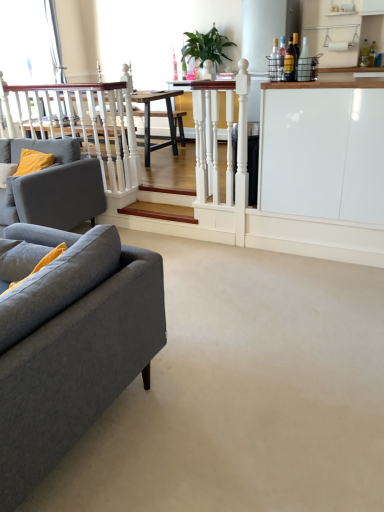
Describe the element at coordinates (323, 148) in the screenshot. The width and height of the screenshot is (384, 512). I see `white glossy cabinet at right` at that location.

How much space does matte gray fabric couch at left, which appears as the 2th studio couch when viewed from the front, occupy vertically?

34.49 inches.

At what (x,y) coordinates should I click in order to perform the action: click on green leafy plant at upper center. Please return your answer as a coordinate pair (x, y). Looking at the image, I should click on coord(206,47).

I want to click on gray fabric couch at left, which is counted as the 1th studio couch, starting from the front, so click(69, 342).

Measure the distance between gray fabric couch at left, the 2th studio couch from the back, and camera.

gray fabric couch at left, the 2th studio couch from the back, and camera are 1.21 meters apart from each other.

You are a GUI agent. You are given a task and a screenshot of the screen. Output one action in this format:
    pyautogui.click(x=<x>, y=<y>)
    Task: Click on the white glossy cabinet at right
    The width and height of the screenshot is (384, 512).
    Given the screenshot: What is the action you would take?
    [x=323, y=148]

What's the angular difference between wooden stairs at center and white glossy cabinet at right's facing directions?

They differ by 180 degrees in their facing directions.

Based on their sizes in the image, would you say wooden stairs at center is bigger or smaller than white glossy cabinet at right?

In the image, wooden stairs at center appears to be smaller than white glossy cabinet at right.

Consider the image. From a real-world perspective, who is located lower, wooden stairs at center or white glossy cabinet at right?

wooden stairs at center.

I want to click on stairwell located behind the gray fabric couch at left, which is counted as the 1th studio couch, starting from the front, so click(160, 211).

Does gray fabric couch at left, which is counted as the 1th studio couch, starting from the front, turn towards wooden stairs at center?

No, gray fabric couch at left, which is counted as the 1th studio couch, starting from the front, is not facing towards wooden stairs at center.

From a real-world perspective, between gray fabric couch at left, which is counted as the 1th studio couch, starting from the front, and wooden stairs at center, who is vertically lower?

wooden stairs at center is physically lower.

Considering the sizes of objects gray fabric couch at left, which is counted as the 1th studio couch, starting from the front, and wooden stairs at center in the image provided, who is taller, gray fabric couch at left, which is counted as the 1th studio couch, starting from the front, or wooden stairs at center?

gray fabric couch at left, which is counted as the 1th studio couch, starting from the front, is taller.

From a real-world perspective, does white glossy cabinet at right stand above gray fabric couch at left, the 2th studio couch from the back?

Yes, from a real-world perspective, white glossy cabinet at right is above gray fabric couch at left, the 2th studio couch from the back.

Which of these two, white glossy cabinet at right or gray fabric couch at left, which is counted as the 1th studio couch, starting from the front, is bigger?

gray fabric couch at left, which is counted as the 1th studio couch, starting from the front, is bigger.

Can you confirm if white glossy cabinet at right is thinner than gray fabric couch at left, the 2th studio couch from the back?

Correct, the width of white glossy cabinet at right is less than that of gray fabric couch at left, the 2th studio couch from the back.

Identify the location of cabinetry above the gray fabric couch at left, which is counted as the 1th studio couch, starting from the front (from a real-world perspective). (323, 148).

Which is in front, wooden stairs at center or green leafy plant at upper center?

wooden stairs at center is more forward.

Can you see wooden stairs at center touching green leafy plant at upper center?

No, wooden stairs at center is not with green leafy plant at upper center.

Does wooden stairs at center have a greater height compared to green leafy plant at upper center?

No, wooden stairs at center is not taller than green leafy plant at upper center.

Considering the relative positions of wooden stairs at center and green leafy plant at upper center in the image provided, is wooden stairs at center to the right of green leafy plant at upper center from the viewer's perspective?

No.

Where is `stairwell that appears in front of the green leafy plant at upper center`? The image size is (384, 512). stairwell that appears in front of the green leafy plant at upper center is located at coordinates (160, 211).

In the scene shown: From a real-world perspective, between green leafy plant at upper center and wooden stairs at center, who is vertically lower?

From a 3D spatial view, wooden stairs at center is below.

Does matte gray fabric couch at left, which ranks as the first studio couch in back-to-front order, have a lesser height compared to gray fabric couch at left, the 2th studio couch from the back?

No.

Identify the location of studio couch behind the gray fabric couch at left, which is counted as the 1th studio couch, starting from the front. (53, 187).

Which is behind, matte gray fabric couch at left, which appears as the 2th studio couch when viewed from the front, or gray fabric couch at left, which is counted as the 1th studio couch, starting from the front?

matte gray fabric couch at left, which appears as the 2th studio couch when viewed from the front, is behind.

From a real-world perspective, is matte gray fabric couch at left, which appears as the 2th studio couch when viewed from the front, on gray fabric couch at left, the 2th studio couch from the back?

Indeed, from a real-world perspective, matte gray fabric couch at left, which appears as the 2th studio couch when viewed from the front, stands above gray fabric couch at left, the 2th studio couch from the back.

From the image's perspective, between gray fabric couch at left, which is counted as the 1th studio couch, starting from the front, and white glossy cabinet at right, which one is located above?

white glossy cabinet at right.

From their relative heights in the image, would you say gray fabric couch at left, which is counted as the 1th studio couch, starting from the front, is taller or shorter than white glossy cabinet at right?

Answer: Considering their sizes, gray fabric couch at left, which is counted as the 1th studio couch, starting from the front, has less height than white glossy cabinet at right.

Can you confirm if gray fabric couch at left, which is counted as the 1th studio couch, starting from the front, is bigger than white glossy cabinet at right?

Yes, gray fabric couch at left, which is counted as the 1th studio couch, starting from the front, is bigger than white glossy cabinet at right.

From the picture: Which object is further away from the camera, gray fabric couch at left, the 2th studio couch from the back, or white glossy cabinet at right?

white glossy cabinet at right is more distant.

Image resolution: width=384 pixels, height=512 pixels. Identify the location of cabinetry above the wooden stairs at center (from the image's perspective). (323, 148).

From a real-world perspective, which studio couch is the 1st one above the wooden stairs at center? Please provide its 2D coordinates.

[(69, 342)]

From the image, which object appears to be nearer to green leafy plant at upper center, wooden stairs at center or white glossy cabinet at right?

The object closer to green leafy plant at upper center is wooden stairs at center.

Looking at the image, which one is located closer to white glossy cabinet at right, gray fabric couch at left, which is counted as the 1th studio couch, starting from the front, or matte gray fabric couch at left, which ranks as the first studio couch in back-to-front order?

matte gray fabric couch at left, which ranks as the first studio couch in back-to-front order.

Which object lies nearer to the anchor point matte gray fabric couch at left, which appears as the 2th studio couch when viewed from the front, white glossy cabinet at right or wooden stairs at center?

wooden stairs at center is closer to matte gray fabric couch at left, which appears as the 2th studio couch when viewed from the front.

Based on their spatial positions, is matte gray fabric couch at left, which ranks as the first studio couch in back-to-front order, or green leafy plant at upper center closer to gray fabric couch at left, the 2th studio couch from the back?

matte gray fabric couch at left, which ranks as the first studio couch in back-to-front order, lies closer to gray fabric couch at left, the 2th studio couch from the back, than the other object.

Based on their spatial positions, is green leafy plant at upper center or white glossy cabinet at right further from wooden stairs at center?

green leafy plant at upper center is further to wooden stairs at center.

When comparing their distances from wooden stairs at center, does green leafy plant at upper center or matte gray fabric couch at left, which ranks as the first studio couch in back-to-front order, seem further?

Based on the image, green leafy plant at upper center appears to be further to wooden stairs at center.

Considering their positions, is wooden stairs at center positioned further to white glossy cabinet at right than gray fabric couch at left, which is counted as the 1th studio couch, starting from the front?

Among the two, gray fabric couch at left, which is counted as the 1th studio couch, starting from the front, is located further to white glossy cabinet at right.

Which object lies further to the anchor point matte gray fabric couch at left, which ranks as the first studio couch in back-to-front order, wooden stairs at center or gray fabric couch at left, which is counted as the 1th studio couch, starting from the front?

The object further to matte gray fabric couch at left, which ranks as the first studio couch in back-to-front order, is gray fabric couch at left, which is counted as the 1th studio couch, starting from the front.

Find the location of a particular element. The width and height of the screenshot is (384, 512). stairwell between gray fabric couch at left, the 2th studio couch from the back, and green leafy plant at upper center from front to back is located at coordinates (160, 211).

Identify the location of studio couch between gray fabric couch at left, which is counted as the 1th studio couch, starting from the front, and green leafy plant at upper center, along the z-axis. (53, 187).

Locate an element on the screen. This screenshot has height=512, width=384. stairwell between white glossy cabinet at right and green leafy plant at upper center along the z-axis is located at coordinates (160, 211).

Locate an element on the screen. studio couch positioned between gray fabric couch at left, the 2th studio couch from the back, and wooden stairs at center from near to far is located at coordinates pyautogui.click(x=53, y=187).